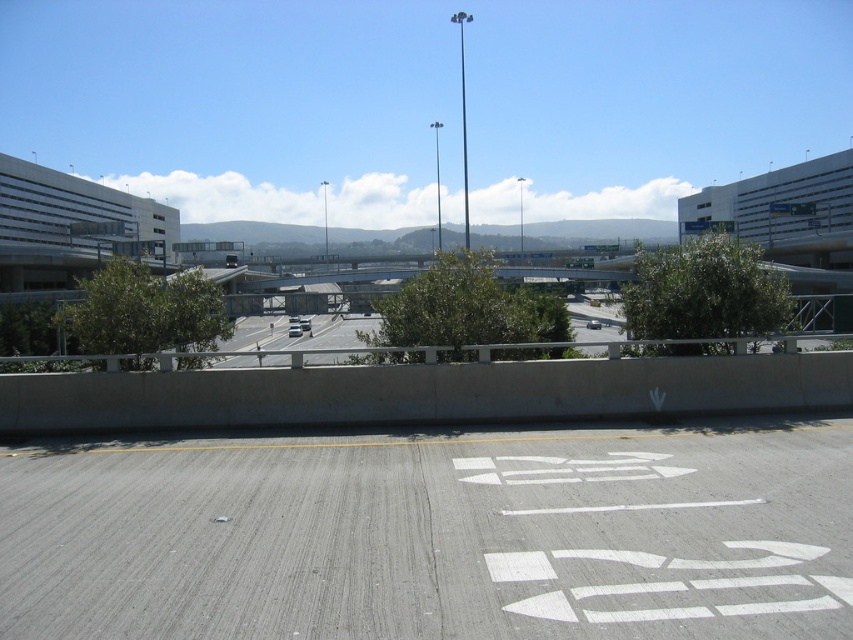
Question: Which point is farther to the camera?

Choices:
 (A) (685, 506)
 (B) (274, 336)

Answer: (B)

Question: Which of the following is the closest to the observer?

Choices:
 (A) gray asphalt highway at center
 (B) gray asphalt road at center

Answer: (B)

Question: Considering the relative positions of gray asphalt road at center and gray asphalt highway at center in the image provided, where is gray asphalt road at center located with respect to gray asphalt highway at center?

Choices:
 (A) below
 (B) above

Answer: (A)

Question: Which point is farther from the camera taking this photo?

Choices:
 (A) (723, 586)
 (B) (358, 316)

Answer: (B)

Question: Is gray asphalt road at center further to camera compared to gray asphalt highway at center?

Choices:
 (A) yes
 (B) no

Answer: (B)

Question: Is gray asphalt road at center to the right of gray asphalt highway at center from the viewer's perspective?

Choices:
 (A) no
 (B) yes

Answer: (B)